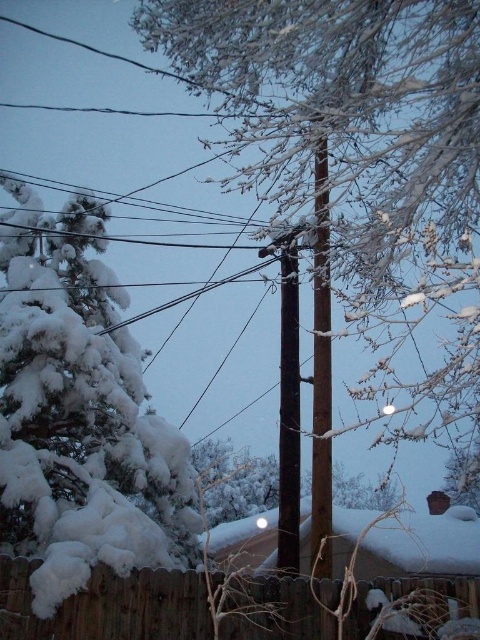
Question: Which of the following is the closest to the observer?

Choices:
 (A) brown wooden telegraph pole at center
 (B) wooden fence at lower center

Answer: (B)

Question: Does snow-covered pine tree at left appear under white fluffy tree at left?

Choices:
 (A) yes
 (B) no

Answer: (B)

Question: Does wooden fence at lower center have a larger size compared to brown wood telegraph pole at center?

Choices:
 (A) yes
 (B) no

Answer: (B)

Question: Which point is closer to the camera?

Choices:
 (A) wooden fence at lower center
 (B) brown wood telegraph pole at center
 (C) brown wooden telegraph pole at center
 (D) white fluffy tree at left

Answer: (A)

Question: Which object is positioned farthest from the snow-covered pine tree at left?

Choices:
 (A) wooden fence at lower center
 (B) brown wooden telegraph pole at center

Answer: (A)

Question: Does white fluffy tree at left have a larger size compared to wooden fence at lower center?

Choices:
 (A) no
 (B) yes

Answer: (B)